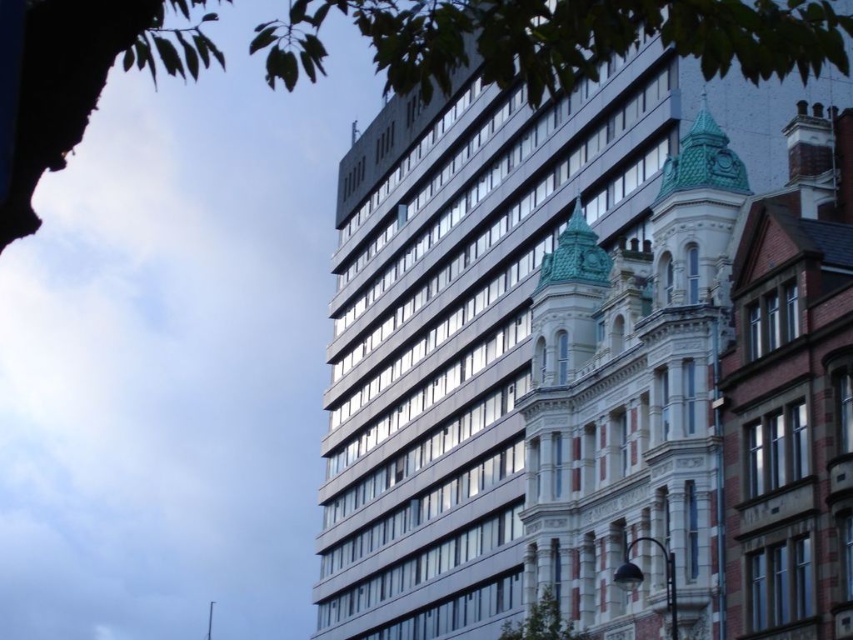
Question: Is metallic glass building at upper center to the left of white stone building at center from the viewer's perspective?

Choices:
 (A) no
 (B) yes

Answer: (B)

Question: Is metallic glass building at upper center below white stone building at center?

Choices:
 (A) yes
 (B) no

Answer: (B)

Question: Among these objects, which one is farthest from the camera?

Choices:
 (A) white stone building at center
 (B) metallic glass building at upper center

Answer: (B)

Question: Is metallic glass building at upper center thinner than white stone building at center?

Choices:
 (A) no
 (B) yes

Answer: (A)